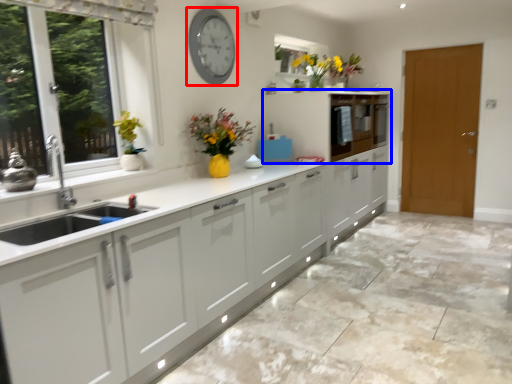
Question: Which point is further to the camera, clock (highlighted by a red box) or cabinetry (highlighted by a blue box)?

Choices:
 (A) clock
 (B) cabinetry

Answer: (B)